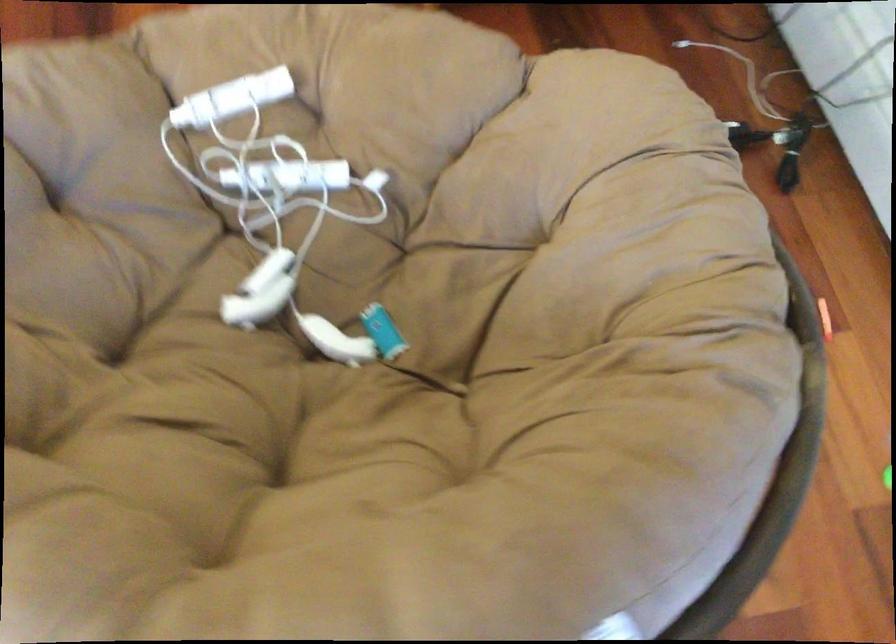
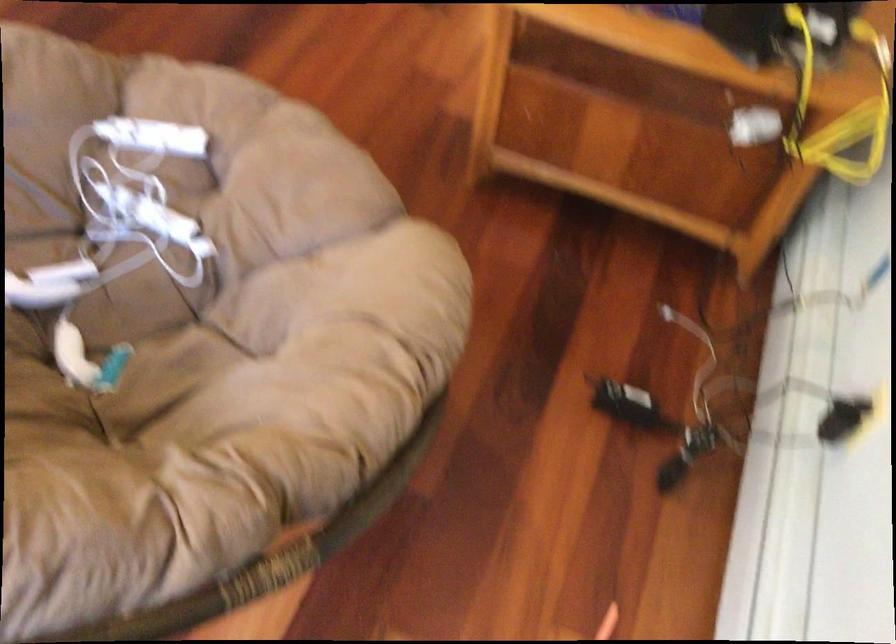
The point at [231,93] is marked in the first image. Where is the corresponding point in the second image?

(152, 137)